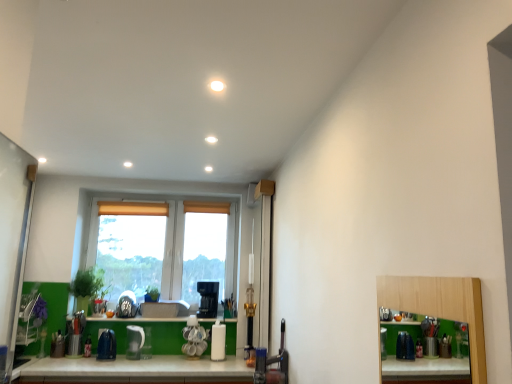
Question: Is green matte window sill at lower center at the right side of white plastic window at center?

Choices:
 (A) no
 (B) yes

Answer: (B)

Question: From the image's perspective, is green matte window sill at lower center below white plastic window at center?

Choices:
 (A) yes
 (B) no

Answer: (A)

Question: Is green matte window sill at lower center completely or partially outside of white plastic window at center?

Choices:
 (A) yes
 (B) no

Answer: (A)

Question: Does green matte window sill at lower center have a larger size compared to white plastic window at center?

Choices:
 (A) yes
 (B) no

Answer: (B)

Question: Is green matte window sill at lower center far from white plastic window at center?

Choices:
 (A) yes
 (B) no

Answer: (B)

Question: From a real-world perspective, is green matte window sill at lower center located beneath white plastic window at center?

Choices:
 (A) yes
 (B) no

Answer: (A)

Question: Is white glossy coffee maker at center, placed as the 3th appliance when sorted from left to right, at the left side of green matte plant at center, arranged as the first plant when viewed from the right?

Choices:
 (A) yes
 (B) no

Answer: (B)

Question: From the image's perspective, is white glossy coffee maker at center, placed as the 3th appliance when sorted from left to right, located above green matte plant at center, which is the second plant in left-to-right order?

Choices:
 (A) no
 (B) yes

Answer: (A)

Question: Is white glossy coffee maker at center, which appears as the first appliance when viewed from the right, positioned in front of green matte plant at center, which is the second plant in left-to-right order?

Choices:
 (A) no
 (B) yes

Answer: (B)

Question: Is white glossy coffee maker at center, which appears as the first appliance when viewed from the right, bigger than green matte plant at center, arranged as the first plant when viewed from the right?

Choices:
 (A) no
 (B) yes

Answer: (B)

Question: Is white glossy coffee maker at center, placed as the 3th appliance when sorted from left to right, further to camera compared to green matte plant at center, arranged as the first plant when viewed from the right?

Choices:
 (A) no
 (B) yes

Answer: (A)

Question: Is green matte plant at center, which is the second plant in left-to-right order, a part of white glossy coffee maker at center, which appears as the first appliance when viewed from the right?

Choices:
 (A) no
 (B) yes

Answer: (A)

Question: Is green matte plant at left, the 2th plant positioned from the right, further to the viewer compared to white glossy kettle at center, placed as the second appliance when sorted from right to left?

Choices:
 (A) yes
 (B) no

Answer: (A)